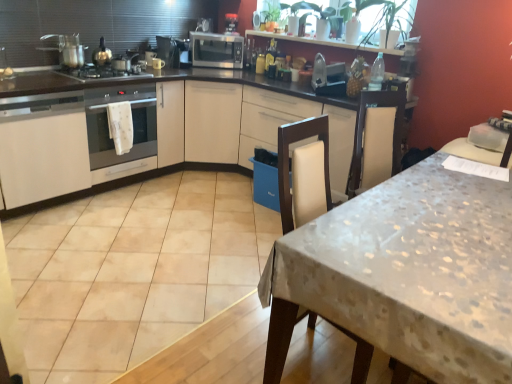
Question: In terms of height, does satin black microwave at upper center, marked as the 2th appliance in a bottom-to-top arrangement, look taller or shorter compared to satin silver microwave at center, which is the 2th kitchen appliance in bottom-to-top order?

Choices:
 (A) tall
 (B) short

Answer: (B)

Question: Is point (176, 48) positioned closer to the camera than point (228, 66)?

Choices:
 (A) closer
 (B) farther

Answer: (A)

Question: Which of these objects is positioned farthest from the black plastic coffee machine at upper center?

Choices:
 (A) white glossy cabinet at left
 (B) green glossy plant at upper center
 (C) satin silver microwave at center
 (D) metallic microwave at upper center, which is the third appliance from front to back
 (E) satin black microwave at upper center, which ranks as the third appliance in right-to-left order

Answer: (A)

Question: Which of these objects is positioned closest to the black plastic coffee machine at upper center?

Choices:
 (A) white fabric towel at left
 (B) satin silver gas stove at left
 (C) white textured table at center
 (D) satin black microwave at upper center, which is counted as the 2th appliance, starting from the front
 (E) shiny silver pot at upper left, which is the 2th kitchen appliance from back to front

Answer: (D)